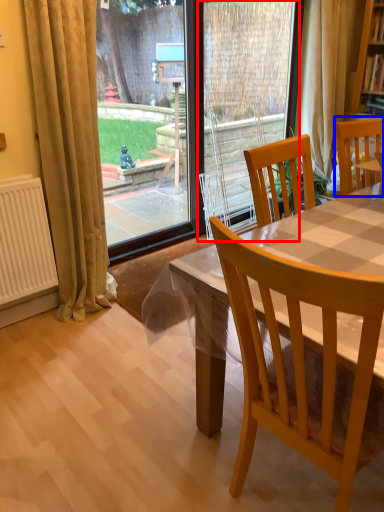
Question: Which object appears closest to the camera in this image, screen door (highlighted by a red box) or chair (highlighted by a blue box)?

Choices:
 (A) screen door
 (B) chair

Answer: (B)